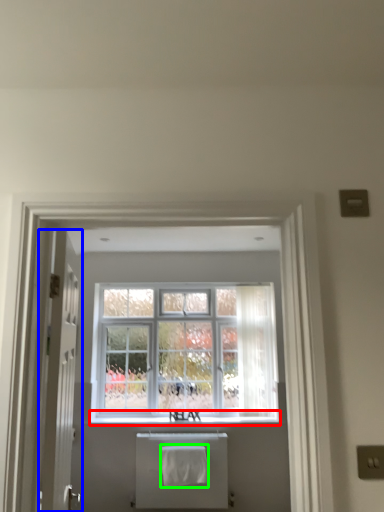
Question: Estimate the real-world distances between objects in this image. Which object is farther from window sill (highlighted by a red box), door (highlighted by a blue box) or bath towel (highlighted by a green box)?

Choices:
 (A) door
 (B) bath towel

Answer: (A)